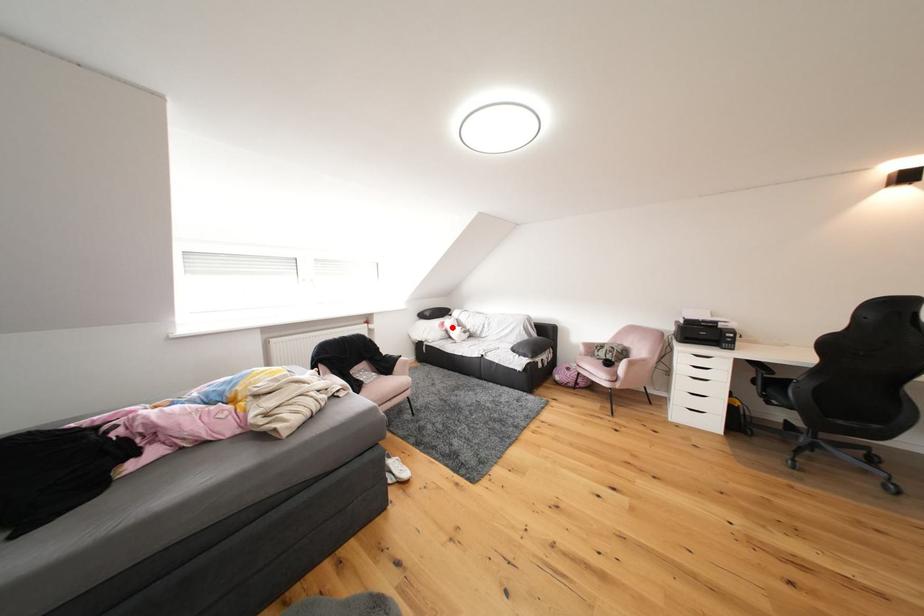
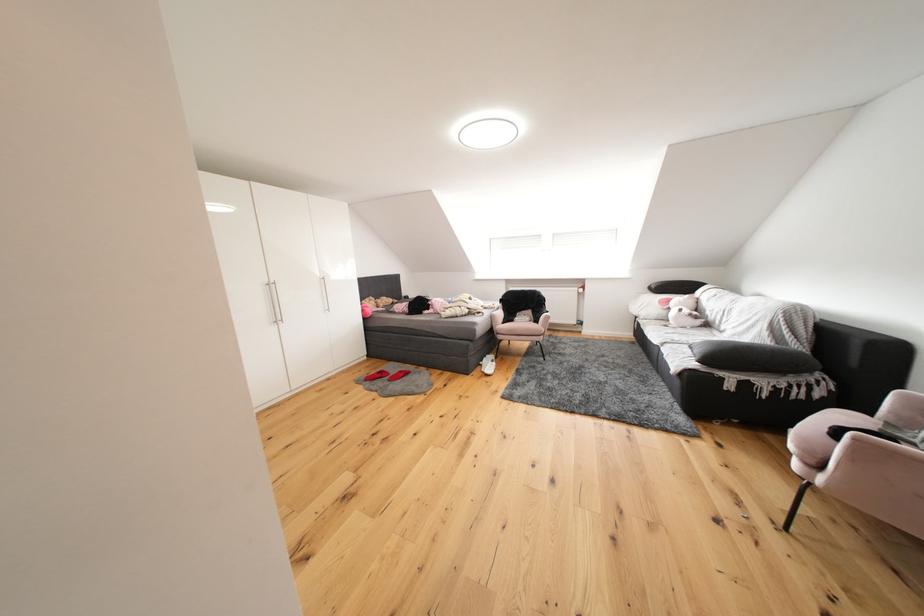
Locate, in the second image, the point that corresponds to the highlighted location in the first image.

(677, 305)